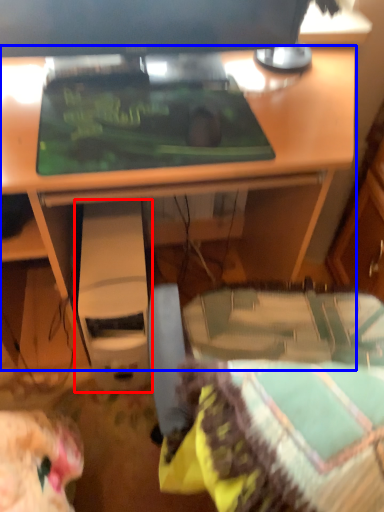
Question: Which of the following is the closest to the observer, computer (highlighted by a red box) or desk (highlighted by a blue box)?

Choices:
 (A) computer
 (B) desk

Answer: (B)